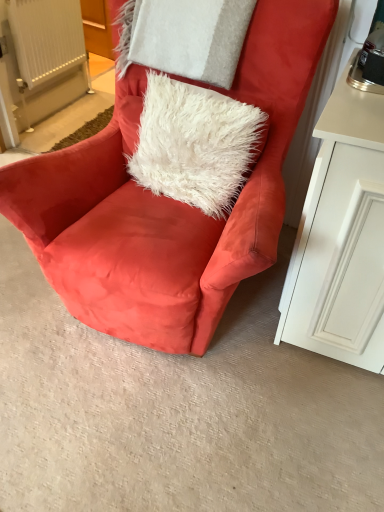
Question: Is white fluffy pillow at upper center wider or thinner than white plastic radiator at upper left?

Choices:
 (A) wide
 (B) thin

Answer: (A)

Question: Considering the positions of point click(175, 44) and point click(14, 34), is point click(175, 44) closer or farther from the camera than point click(14, 34)?

Choices:
 (A) farther
 (B) closer

Answer: (B)

Question: Which object is positioned farthest from the suede orange chair at center?

Choices:
 (A) white fluffy pillow at upper center
 (B) white plastic radiator at upper left
 (C) white fluffy pillow at upper center

Answer: (B)

Question: Which object is the closest to the white fluffy pillow at upper center?

Choices:
 (A) white plastic radiator at upper left
 (B) suede orange chair at center
 (C) white fluffy pillow at upper center

Answer: (C)